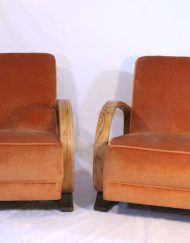
At what (x,y) coordinates should I click in order to perform the action: click on no pictures on the wall. Please return your answer as a coordinate pair (x, y). This screenshot has width=190, height=243. Looking at the image, I should click on (91, 40).